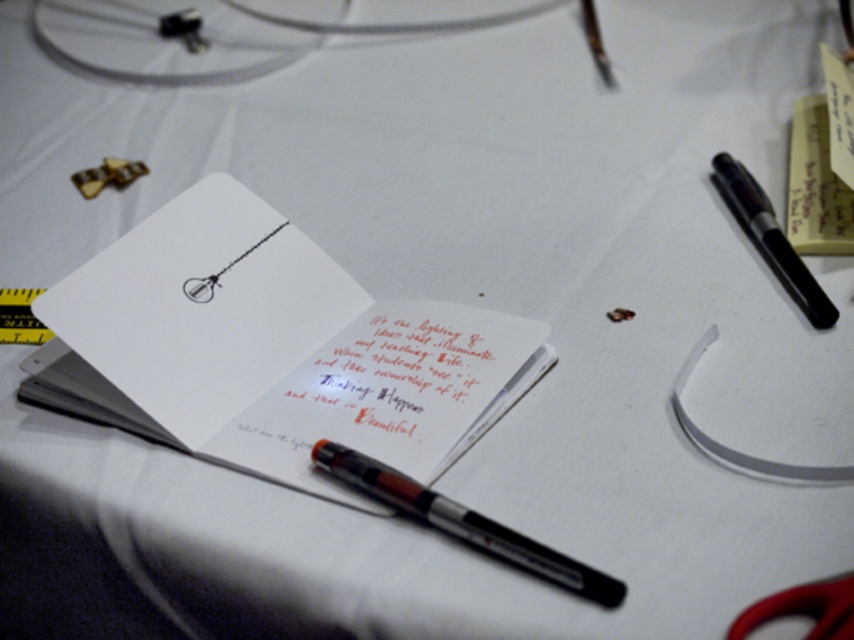
Question: Does handwritten paper at center lie in front of translucent plastic pen at center?

Choices:
 (A) yes
 (B) no

Answer: (B)

Question: Is translucent plastic pen at center positioned at the back of black glossy pen at upper right?

Choices:
 (A) yes
 (B) no

Answer: (B)

Question: Based on their relative distances, which object is nearer to the red plastic scissors at lower right?

Choices:
 (A) black glossy pen at upper right
 (B) yellow matte ruler at lower left
 (C) translucent plastic pen at center

Answer: (C)

Question: Is white paper notepad at center bigger than yellow matte ruler at lower left?

Choices:
 (A) yes
 (B) no

Answer: (A)

Question: Which point is farther from the camera taking this photo?

Choices:
 (A) (597, 586)
 (B) (793, 168)

Answer: (B)

Question: Which object is positioned closest to the black glossy pen at upper right?

Choices:
 (A) yellow paper at upper right
 (B) white paper notepad at center

Answer: (A)